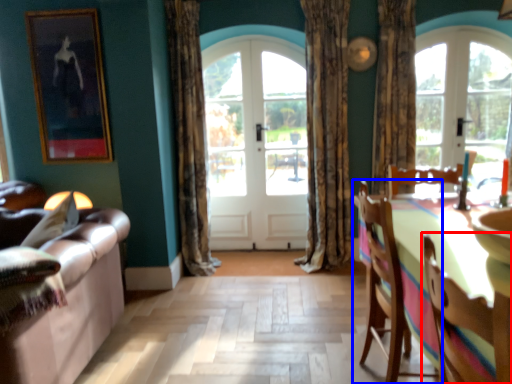
Question: Which point is closer to the camera, chair (highlighted by a red box) or chair (highlighted by a blue box)?

Choices:
 (A) chair
 (B) chair

Answer: (A)